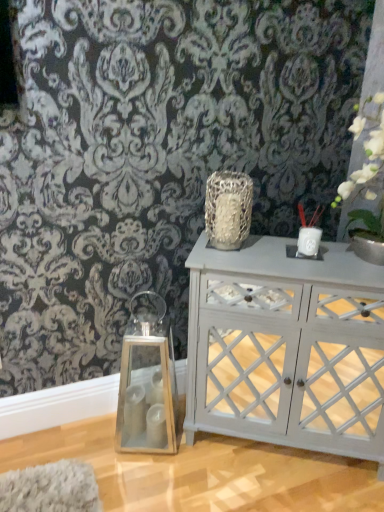
The image size is (384, 512). I want to click on vacant space that's between clear glass lantern at left, the third candle holder from the top, and white painted wood cabinet at center, so click(x=238, y=466).